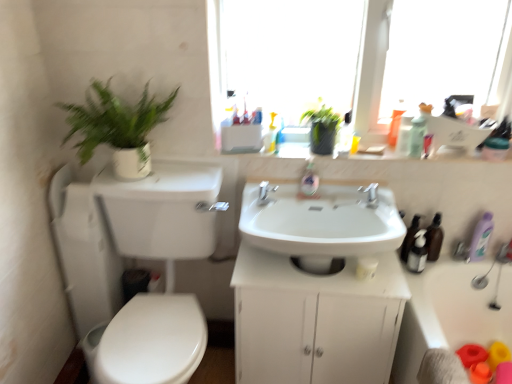
You are a GUI agent. You are given a task and a screenshot of the screen. Output one action in this format:
    pyautogui.click(x=<x>, y=<y>)
    Task: Click on the vacant space to the right of yellow plastic bottle at upper center, which ranks as the 1th toiletry in left-to-right order
    Image resolution: width=512 pixels, height=384 pixels.
    Given the screenshot: What is the action you would take?
    pyautogui.click(x=379, y=151)